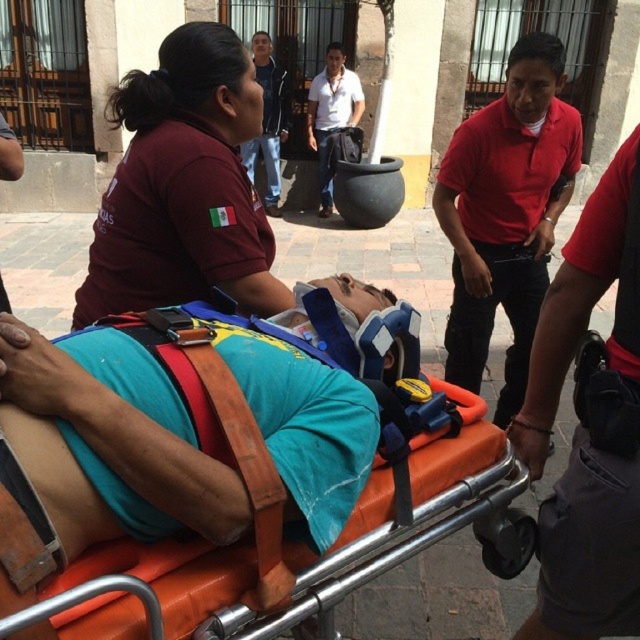
Is red smooth shirt at center behind red cotton shirt at upper right?

No, red smooth shirt at center is closer to the viewer.

Is point (552, 593) positioned before point (492, 112)?

Yes, point (552, 593) is in front of point (492, 112).

Where is `red smooth shirt at center`? Image resolution: width=640 pixels, height=640 pixels. red smooth shirt at center is located at coordinates (588, 548).

Is point (280, 504) positioned before point (477, 204)?

Yes, point (280, 504) is in front of point (477, 204).

Who is positioned more to the right, orange fabric stretcher at center or red cotton shirt at upper right?

red cotton shirt at upper right

You are a GUI agent. You are given a task and a screenshot of the screen. Output one action in this format:
    pyautogui.click(x=<x>, y=<y>)
    Task: Click on the orange fabric stretcher at center
    Image resolution: width=640 pixels, height=640 pixels.
    Given the screenshot: What is the action you would take?
    pyautogui.click(x=237, y=460)

Describe the element at coordinates (182, 186) in the screenshot. I see `matte maroon shirt at upper left` at that location.

Between matte maroon shirt at upper left and red smooth shirt at center, which one appears on the left side from the viewer's perspective?

Positioned to the left is matte maroon shirt at upper left.

Is point (246, 67) more distant than point (604, 586)?

Yes.

Image resolution: width=640 pixels, height=640 pixels. In order to click on matte maroon shirt at upper left in this screenshot , I will do `click(182, 186)`.